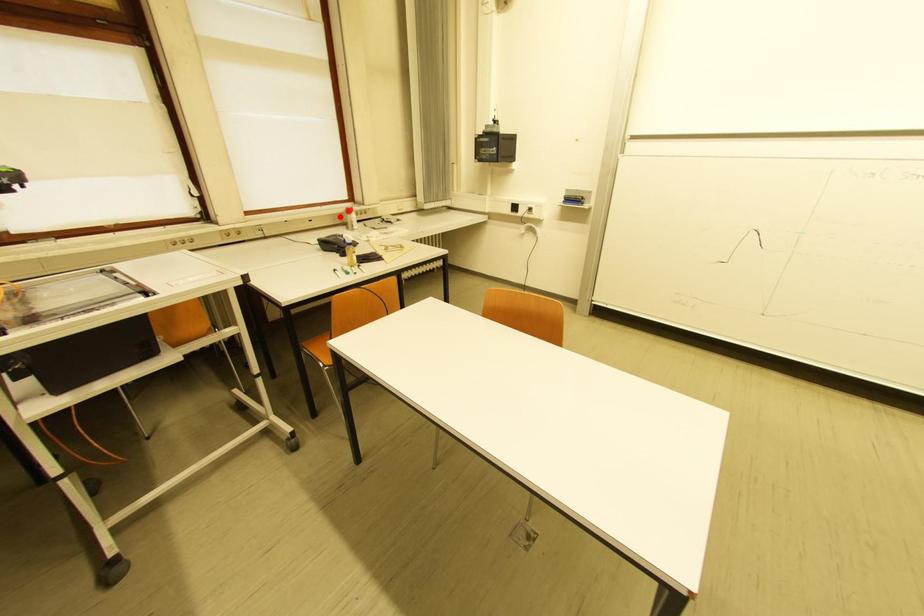
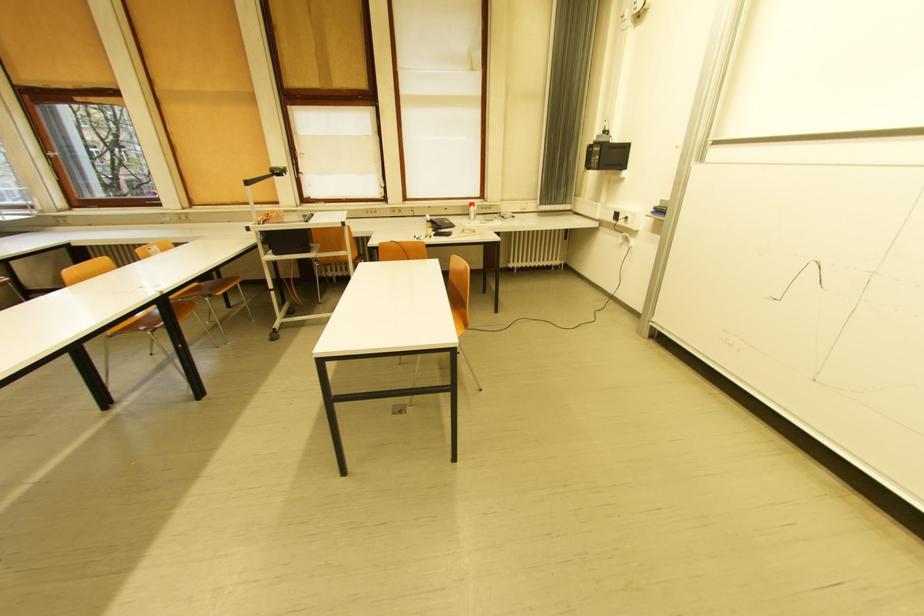
In the second image, find the point that corresponds to the highlighted location in the first image.

(469, 208)